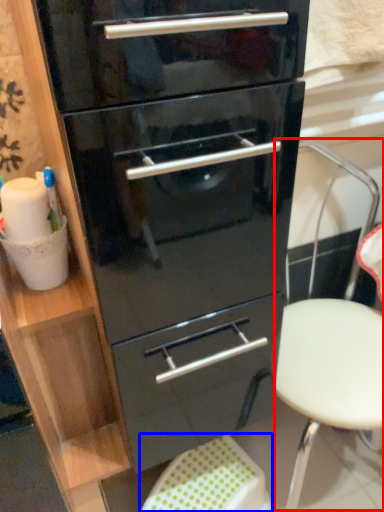
Question: Which of the following is the closest to the observer, folding chair (highlighted by a red box) or step stool (highlighted by a blue box)?

Choices:
 (A) folding chair
 (B) step stool

Answer: (A)